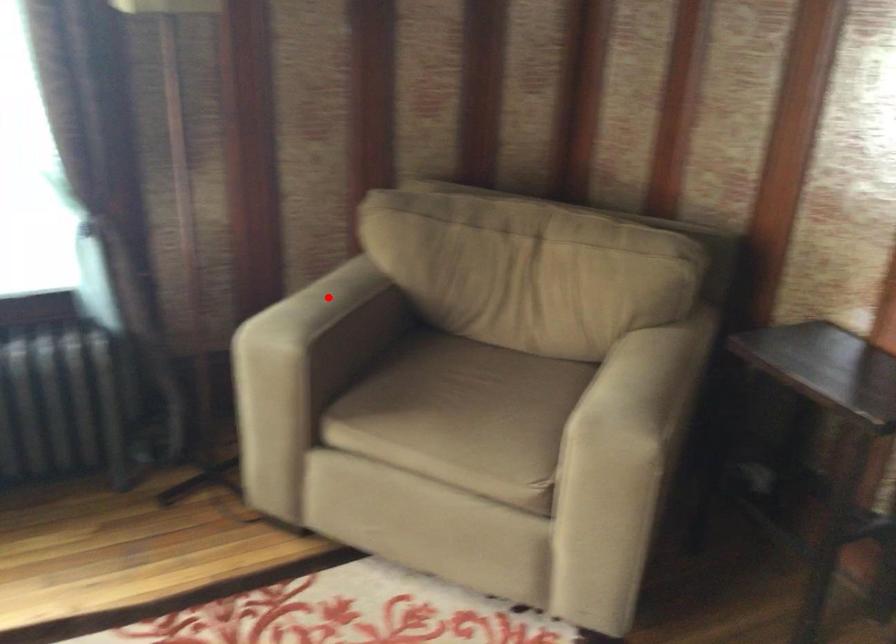
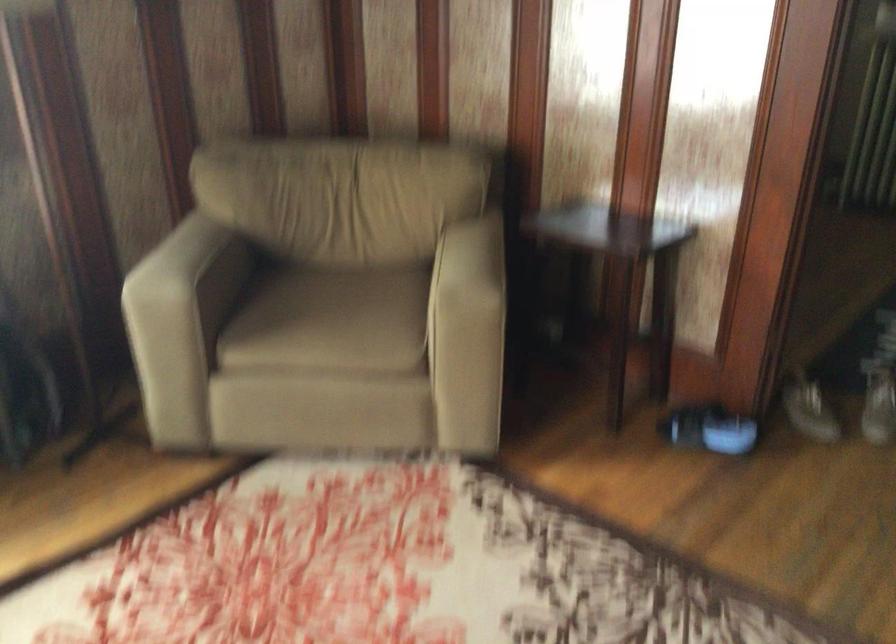
Question: I am providing you with two images of the same scene from different viewpoints. Given a red point in image1, look at the same physical point in image2. Is it:

Choices:
 (A) Closer to the viewpoint
 (B) Farther from the viewpoint

Answer: (B)